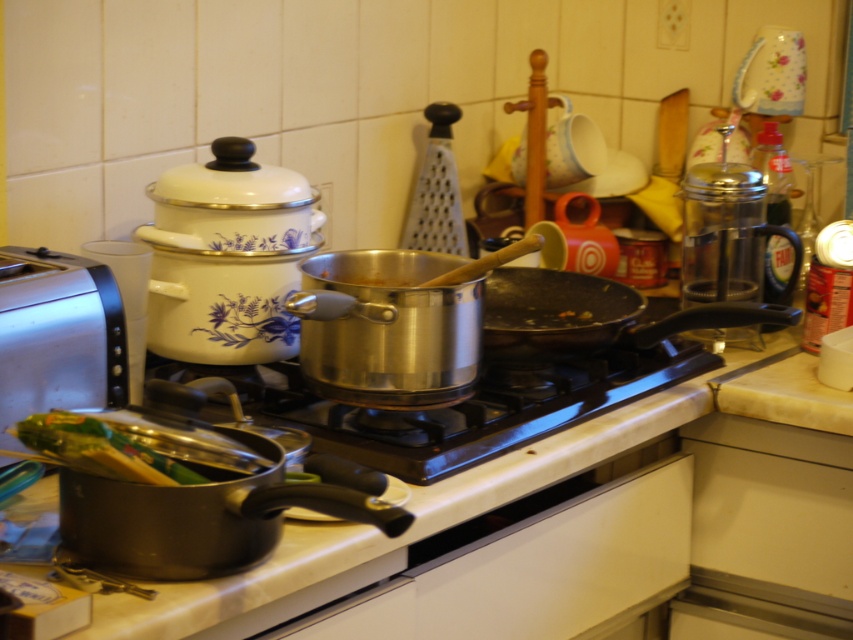
Question: From the image, what is the correct spatial relationship of stainless steel gas stove at center in relation to silver metallic toaster at left?

Choices:
 (A) right
 (B) left

Answer: (A)

Question: Among these objects, which one is nearest to the camera?

Choices:
 (A) silver metallic toaster at left
 (B) non-stick black frying pan at center

Answer: (A)

Question: Which point is farther from the camera taking this photo?

Choices:
 (A) (111, 404)
 (B) (502, 339)
 (C) (291, 390)

Answer: (C)

Question: Where is silver metallic toaster at left located in relation to non-stick black frying pan at center in the image?

Choices:
 (A) left
 (B) right

Answer: (A)

Question: Is stainless steel gas stove at center behind silver metallic toaster at left?

Choices:
 (A) no
 (B) yes

Answer: (B)

Question: Among these points, which one is farthest from the camera?

Choices:
 (A) (618, 314)
 (B) (508, 426)
 (C) (3, 292)

Answer: (A)